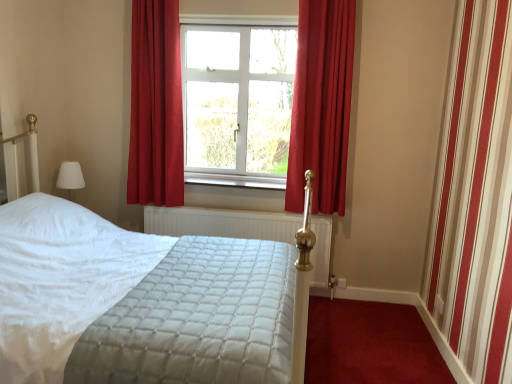
Measure the distance between white quilted mattress at center and camera.

The distance of white quilted mattress at center from camera is 1.50 meters.

Find the location of a particular element. white quilted mattress at center is located at coordinates (206, 317).

Describe the element at coordinates (321, 104) in the screenshot. I see `velvet red curtain at center, the first curtain viewed from the right` at that location.

Describe the element at coordinates (221, 223) in the screenshot. I see `white textured radiator at center` at that location.

Measure the distance between point (166, 78) and camera.

A distance of 3.31 meters exists between point (166, 78) and camera.

What do you see at coordinates (238, 103) in the screenshot? I see `white plastic window at center` at bounding box center [238, 103].

The image size is (512, 384). I want to click on white plastic window at center, so click(238, 103).

At what (x,y) coordinates should I click in order to perform the action: click on white quilted mattress at center. Please return your answer as a coordinate pair (x, y). This screenshot has height=384, width=512. Looking at the image, I should click on (206, 317).

From a real-world perspective, between white textured radiator at center and matte red curtain at center, arranged as the 1th curtain when viewed from the left, who is vertically higher?

In real-world perspective, matte red curtain at center, arranged as the 1th curtain when viewed from the left, is above.

Is point (288, 229) positioned before point (169, 126)?

No, (288, 229) is further to viewer.

Which object is further away from the camera taking this photo, white textured radiator at center or matte red curtain at center, the second curtain from the right?

Positioned behind is white textured radiator at center.

Is white textured radiator at center far away from matte red curtain at center, the second curtain from the right?

No, there isn't a large distance between white textured radiator at center and matte red curtain at center, the second curtain from the right.

Is point (234, 182) less distant than point (269, 280)?

No, it is not.

Is white painted wood at center not within white quilted mattress at center?

Indeed, white painted wood at center is completely outside white quilted mattress at center.

Can you see white painted wood at center touching white quilted mattress at center?

They are not placed beside each other.

The image size is (512, 384). I want to click on radiator below the white painted wood at center (from the image's perspective), so click(x=221, y=223).

What's the angular difference between white painted wood at center and white textured radiator at center's facing directions?

The angular difference between white painted wood at center and white textured radiator at center is 1.17 degrees.

Can we say white painted wood at center lies outside white textured radiator at center?

white painted wood at center is positioned outside white textured radiator at center.

From a real-world perspective, which object stands above the other?

white painted wood at center, from a real-world perspective.

Considering the sizes of objects velvet red curtain at center, the second curtain in the left-to-right sequence, and white painted wood at center in the image provided, who is shorter, velvet red curtain at center, the second curtain in the left-to-right sequence, or white painted wood at center?

white painted wood at center.

How far apart are velvet red curtain at center, the second curtain in the left-to-right sequence, and white painted wood at center?

They are 27.16 inches apart.

Who is more distant, velvet red curtain at center, the second curtain in the left-to-right sequence, or white painted wood at center?

white painted wood at center is further away from the camera.

Is velvet red curtain at center, the second curtain in the left-to-right sequence, bigger than white painted wood at center?

Yes, velvet red curtain at center, the second curtain in the left-to-right sequence, is bigger than white painted wood at center.

Is the depth of velvet red curtain at center, the second curtain in the left-to-right sequence, less than that of white quilted mattress at center?

No.

Can you confirm if velvet red curtain at center, the second curtain in the left-to-right sequence, is bigger than white quilted mattress at center?

Actually, velvet red curtain at center, the second curtain in the left-to-right sequence, might be smaller than white quilted mattress at center.

How far apart are velvet red curtain at center, the second curtain in the left-to-right sequence, and white quilted mattress at center?

1.29 meters.

From a real-world perspective, which object stands above the other?

velvet red curtain at center, the first curtain viewed from the right, from a real-world perspective.

From a real-world perspective, is white painted wood at center above or below matte red curtain at center, arranged as the 1th curtain when viewed from the left?

white painted wood at center is situated lower than matte red curtain at center, arranged as the 1th curtain when viewed from the left, in the real world.

Would you say white painted wood at center is to the left or to the right of matte red curtain at center, the second curtain from the right, in the picture?

Clearly, white painted wood at center is on the right of matte red curtain at center, the second curtain from the right, in the image.

Looking at the image, does white plastic window at center seem bigger or smaller compared to white painted wood at center?

white plastic window at center is bigger than white painted wood at center.

Between white plastic window at center and white painted wood at center, which one appears on the right side from the viewer's perspective?

white painted wood at center is more to the right.

Looking at this image, from the image's perspective, who appears lower, white plastic window at center or white painted wood at center?

white painted wood at center appears lower in the image.

Consider the image. Can you confirm if white plastic window at center is wider than white painted wood at center?

In fact, white plastic window at center might be narrower than white painted wood at center.

Locate an element on the screen. the 1st curtain above the white textured radiator at center (from a real-world perspective) is located at coordinates (156, 106).

At what (x,y) coordinates should I click in order to perform the action: click on window sill on the right of white quilted mattress at center. Please return your answer as a coordinate pair (x, y). Looking at the image, I should click on (236, 180).

Based on their spatial positions, is matte red curtain at center, arranged as the 1th curtain when viewed from the left, or white painted wood at center further from velvet red curtain at center, the first curtain viewed from the right?

matte red curtain at center, arranged as the 1th curtain when viewed from the left, lies further to velvet red curtain at center, the first curtain viewed from the right, than the other object.

Looking at the image, which one is located closer to white painted wood at center, velvet red curtain at center, the first curtain viewed from the right, or matte red curtain at center, the second curtain from the right?

matte red curtain at center, the second curtain from the right, is closer to white painted wood at center.

Based on their spatial positions, is white quilted mattress at center or white painted wood at center further from white textured radiator at center?

Among the two, white quilted mattress at center is located further to white textured radiator at center.

When comparing their distances from velvet red curtain at center, the second curtain in the left-to-right sequence, does matte red curtain at center, the second curtain from the right, or white quilted mattress at center seem closer?

matte red curtain at center, the second curtain from the right, is positioned closer to the anchor velvet red curtain at center, the second curtain in the left-to-right sequence.

Estimate the real-world distances between objects in this image. Which object is closer to white textured radiator at center, white quilted mattress at center or velvet red curtain at center, the first curtain viewed from the right?

velvet red curtain at center, the first curtain viewed from the right, is positioned closer to the anchor white textured radiator at center.

Considering their positions, is white textured radiator at center positioned closer to white painted wood at center than white plastic window at center?

Among the two, white textured radiator at center is located nearer to white painted wood at center.

Based on their spatial positions, is white plastic window at center or matte red curtain at center, arranged as the 1th curtain when viewed from the left, closer to white textured radiator at center?

matte red curtain at center, arranged as the 1th curtain when viewed from the left.

Looking at the image, which one is located closer to white quilted mattress at center, matte red curtain at center, the second curtain from the right, or white painted wood at center?

matte red curtain at center, the second curtain from the right, is closer to white quilted mattress at center.

Identify the location of curtain positioned between white quilted mattress at center and matte red curtain at center, arranged as the 1th curtain when viewed from the left, from near to far. This screenshot has width=512, height=384. (321, 104).

I want to click on window sill between matte red curtain at center, the second curtain from the right, and velvet red curtain at center, the second curtain in the left-to-right sequence, from left to right, so click(x=236, y=180).

This screenshot has width=512, height=384. I want to click on window located between white quilted mattress at center and white painted wood at center in the depth direction, so click(x=238, y=103).

Locate an element on the screen. The width and height of the screenshot is (512, 384). window sill between white quilted mattress at center and white textured radiator at center along the z-axis is located at coordinates (236, 180).